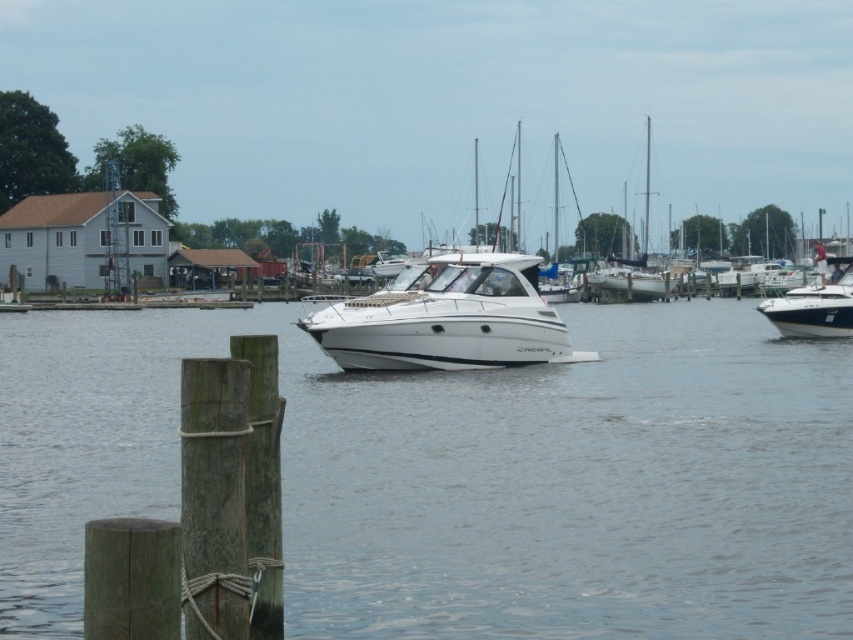
Question: Which of the following is the farthest from the observer?

Choices:
 (A) white glossy boat at center
 (B) clear water at center

Answer: (A)

Question: Which object appears closest to the camera in this image?

Choices:
 (A) white glossy boat at center
 (B) white glossy boat at right
 (C) clear water at center

Answer: (C)

Question: Is clear water at center wider than white glossy boat at center?

Choices:
 (A) yes
 (B) no

Answer: (A)

Question: Is clear water at center positioned behind white glossy boat at center?

Choices:
 (A) no
 (B) yes

Answer: (A)

Question: Where is clear water at center located in relation to white glossy boat at center in the image?

Choices:
 (A) right
 (B) left

Answer: (B)

Question: Which of the following is the closest to the observer?

Choices:
 (A) (476, 385)
 (B) (815, 317)

Answer: (A)